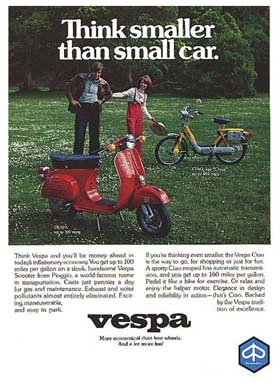
At what (x,y) coordinates should I click in order to perform the action: click on leather. Please return your answer as a coordinate pair (x, y). This screenshot has height=383, width=280. Looking at the image, I should click on (68, 83).